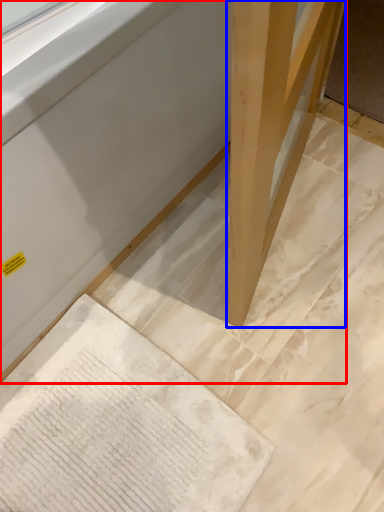
Question: Which object appears closest to the camera in this image, furniture (highlighted by a red box) or wood (highlighted by a blue box)?

Choices:
 (A) furniture
 (B) wood

Answer: (A)